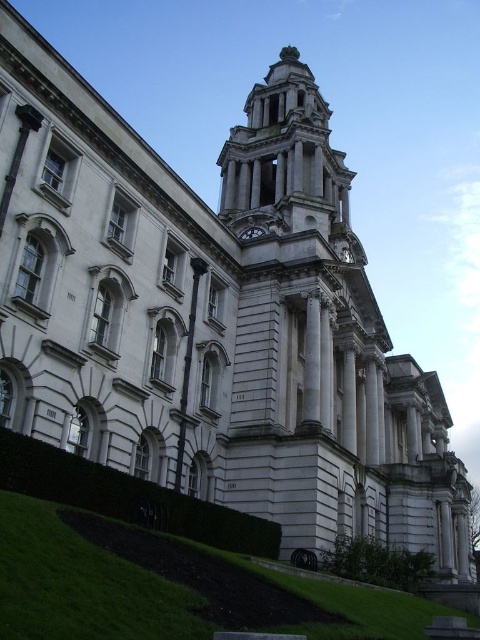
Is white stone clock tower at center positioned at the back of matte silver clock at center?

That is False.

Is white stone clock tower at center closer to camera compared to matte silver clock at center?

Yes.

Locate an element on the screen. This screenshot has height=640, width=480. white stone clock tower at center is located at coordinates (285, 157).